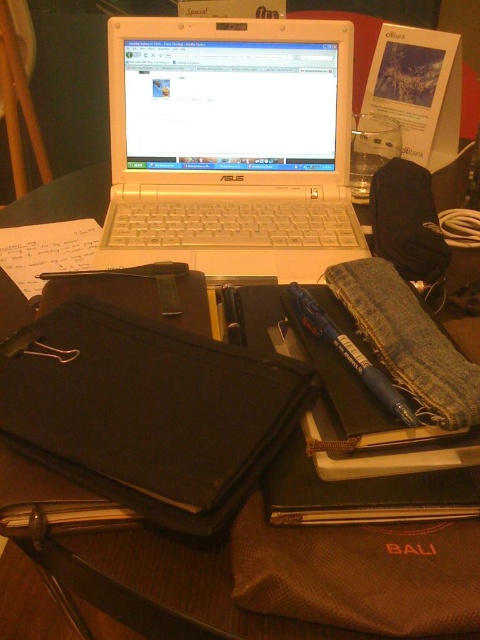
You are organizing your desk and need to move the black fabric binder at lower left closer to the white plastic laptop at center. Which direction should you move the binder to place it next to the laptop?

You should move the black fabric binder at lower left to the right to place it next to the white plastic laptop at center, since the laptop is already positioned to the right of the binder.